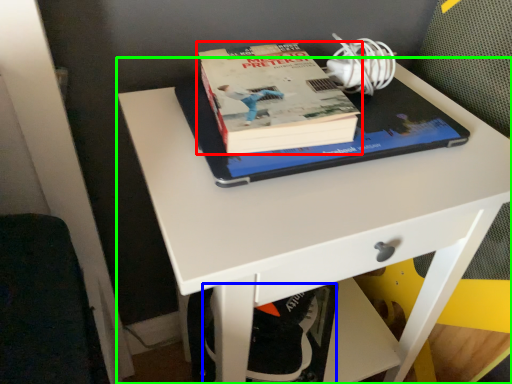
Question: Considering the real-world distances, which object is closest to book (highlighted by a red box)? swivel chair (highlighted by a blue box) or desk (highlighted by a green box).

Choices:
 (A) swivel chair
 (B) desk

Answer: (B)